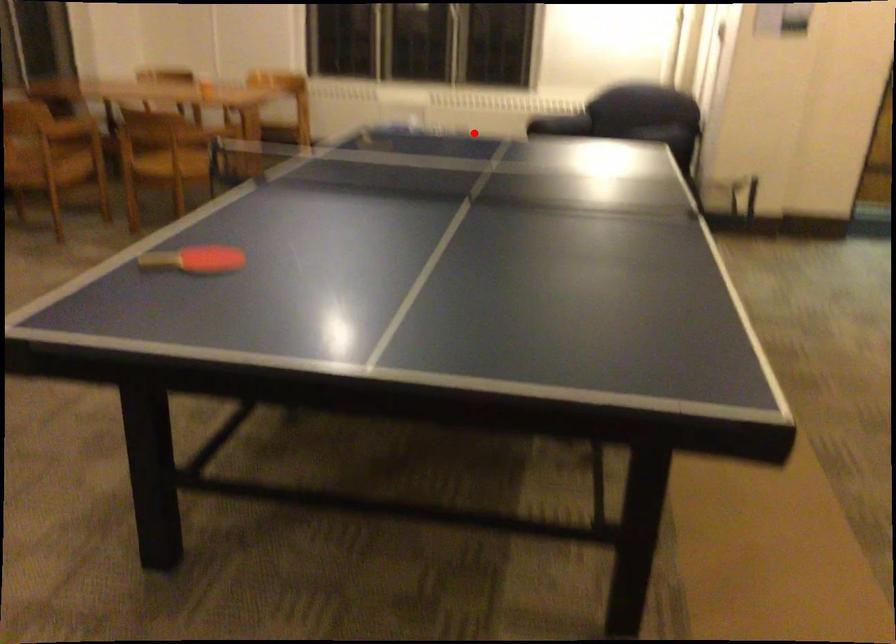
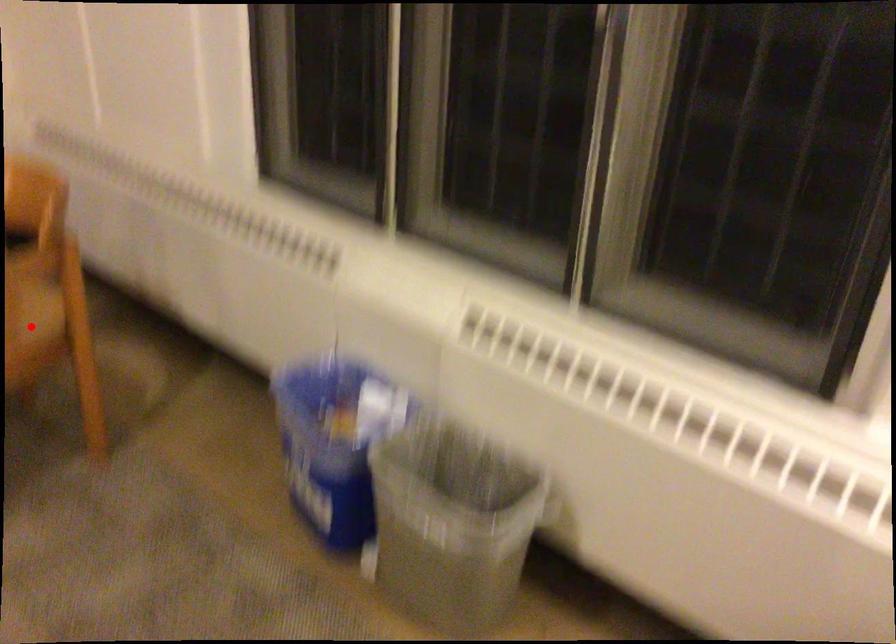
I am providing you with two images of the same scene from different viewpoints. A red point is marked on the first image and another point is marked on the second image. Are the points marked in image1 and image2 representing the same 3D position?

No